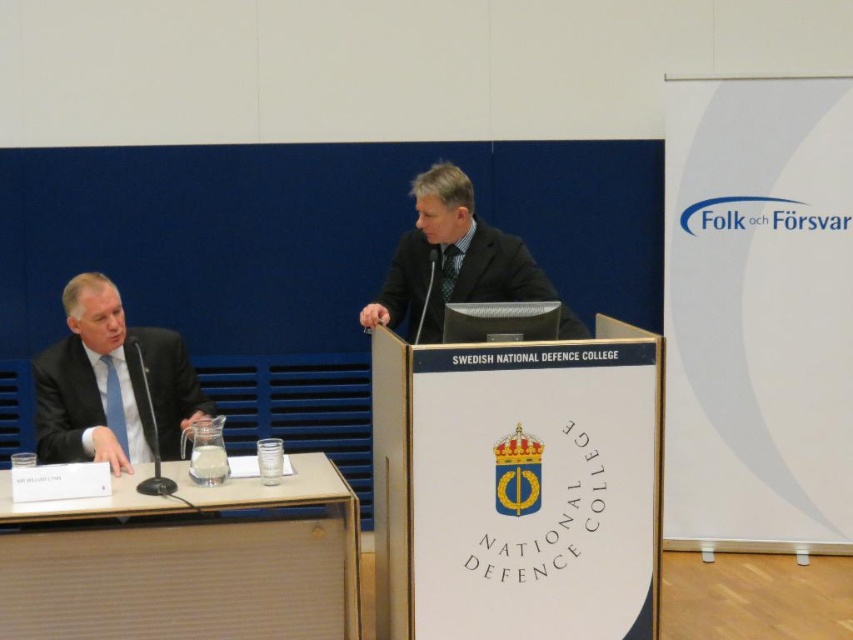
Question: Observing the image, what is the correct spatial positioning of light brown wood table at lower left in reference to matte black suit at left?

Choices:
 (A) below
 (B) above

Answer: (A)

Question: Which of the following is the farthest from the observer?

Choices:
 (A) matte black suit at left
 (B) light brown wood table at lower left
 (C) dark gray suit at center

Answer: (C)

Question: Among these points, which one is farthest from the camera?

Choices:
 (A) (421, 259)
 (B) (7, 541)
 (C) (67, 378)

Answer: (A)

Question: Is light brown wood table at lower left further to camera compared to matte black suit at left?

Choices:
 (A) yes
 (B) no

Answer: (B)

Question: Can you confirm if light brown wood table at lower left is bigger than matte black suit at left?

Choices:
 (A) no
 (B) yes

Answer: (B)

Question: Which object appears closest to the camera in this image?

Choices:
 (A) dark gray suit at center
 (B) light brown wood table at lower left

Answer: (B)